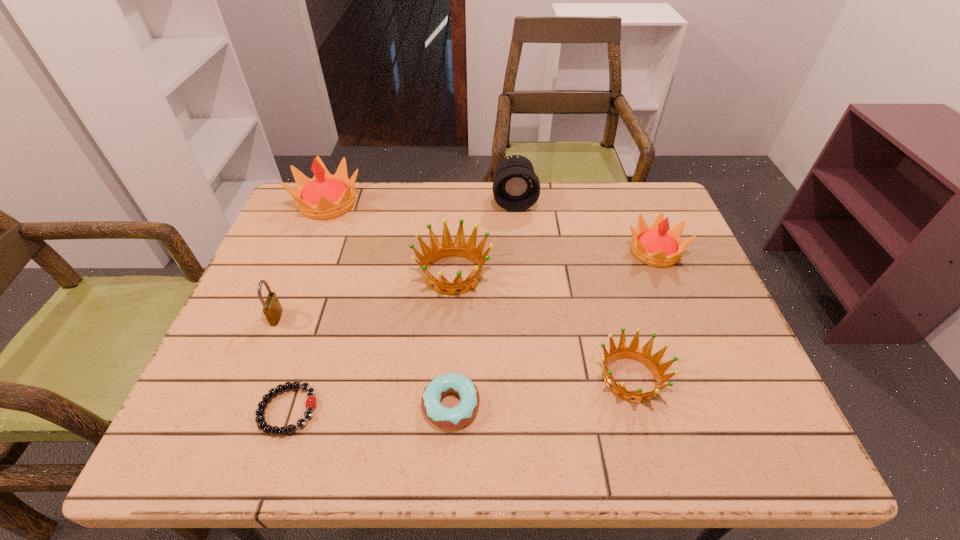
Identify the location of bracelet present at the left edge. The image size is (960, 540). (311, 402).

Identify the location of object present at the right edge. (657, 246).

This screenshot has height=540, width=960. I want to click on object positioned at the far left corner, so click(x=325, y=196).

Locate an element on the screen. This screenshot has height=540, width=960. object located in the near left corner section of the desktop is located at coordinates (311, 402).

You are a GUI agent. You are given a task and a screenshot of the screen. Output one action in this format:
    pyautogui.click(x=<x>, y=<y>)
    Task: Click on the blank space at the far edge of the desktop
    Image resolution: width=960 pixels, height=540 pixels.
    Given the screenshot: What is the action you would take?
    pyautogui.click(x=610, y=220)

The width and height of the screenshot is (960, 540). I want to click on blank area at the near edge, so click(x=325, y=444).

The image size is (960, 540). In the image, there is a desktop. Identify the location of vacant space at the left edge. (335, 239).

Image resolution: width=960 pixels, height=540 pixels. Identify the location of vacant area at the right edge of the desktop. (711, 338).

Identify the location of free space at the far left corner. (316, 222).

What are the coordinates of `vacant space at the near left corner of the desktop` in the screenshot? It's located at (253, 416).